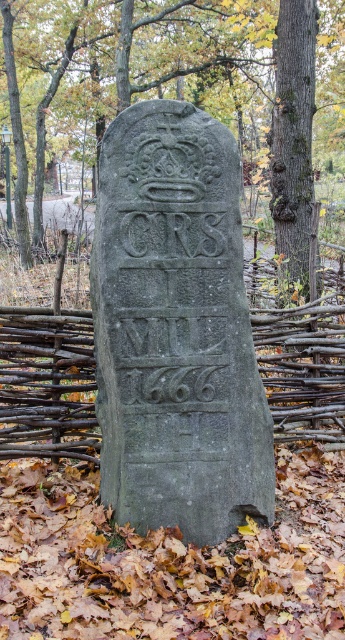
You are standing in front of the gray stone gravestone at center and want to look up at the green mossy bark tree at center right. Is the tree above or below the gravestone?

The gray stone gravestone at center is below the green mossy bark tree at center right, so the tree is above the gravestone.

You are a hiker who wants to take a photo of the green mossy tree at center and the brown wooden fence at center. Which object should you focus on first if you want to capture both in the same frame without moving the camera?

The green mossy tree at center is above the brown wooden fence at center, so you should focus on the brown wooden fence at center first to ensure both are in focus since it is closer to the camera.